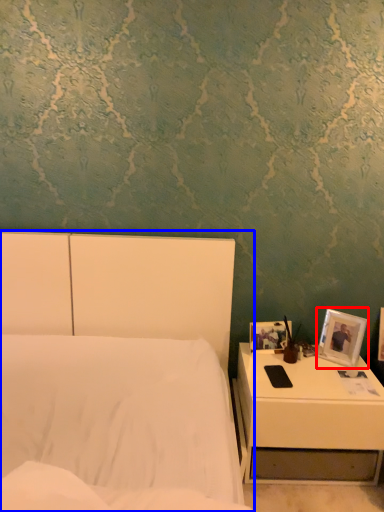
Question: Which object is closer to the camera taking this photo, picture frame (highlighted by a red box) or bed (highlighted by a blue box)?

Choices:
 (A) picture frame
 (B) bed

Answer: (B)